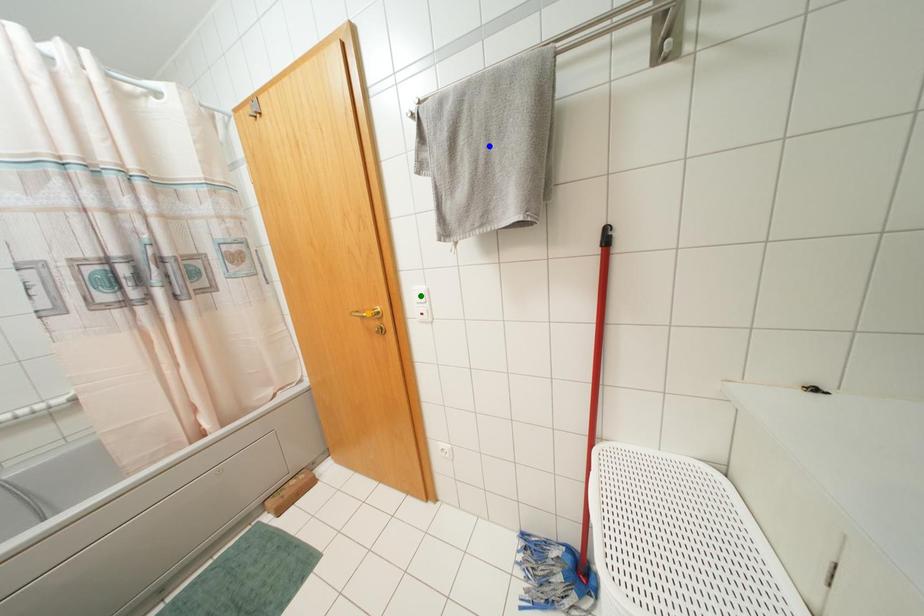
Order these from nearest to farthest:
orange point | green point | blue point

blue point < green point < orange point